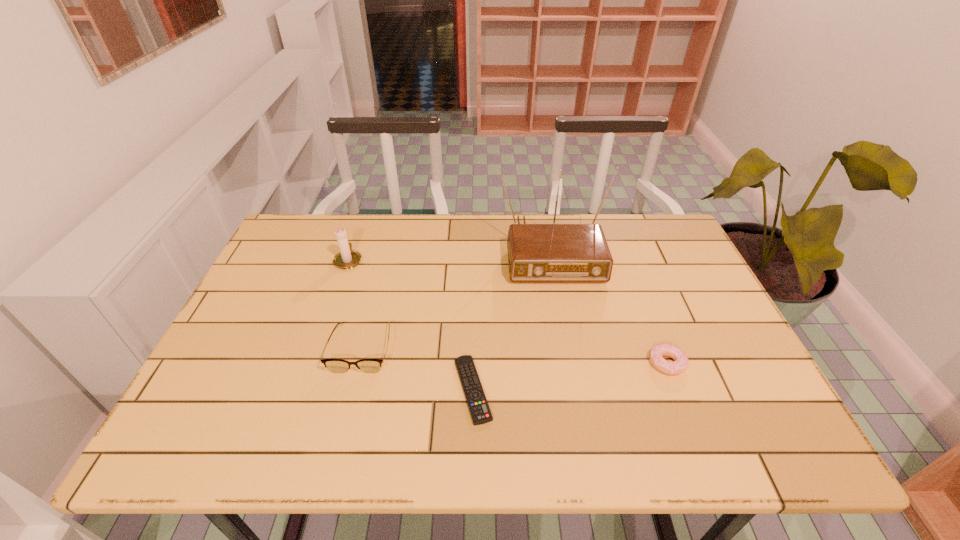
Identify the location of blank space located on the handle side of the second tallest object. tap(361, 223).

In order to click on vacant area situated on the handle side of the second tallest object in this screenshot , I will do `click(359, 230)`.

Identify the location of vacant point located 0.160m on the face of the third shortest object. This screenshot has width=960, height=540. (339, 438).

Locate an element on the screen. The image size is (960, 540). free point located 0.120m on the front of the fourth tallest object is located at coordinates click(692, 427).

Find the location of a particular element. The height and width of the screenshot is (540, 960). vacant point located 0.060m on the front of the third object from right to left is located at coordinates (472, 454).

Identify the location of radio_receiver positioned at the far edge. (537, 253).

You are a GUI agent. You are given a task and a screenshot of the screen. Output one action in this format:
    pyautogui.click(x=<x>, y=<y>)
    Task: Click on the candle holder that is at the far edge
    The image size is (960, 540).
    Given the screenshot: What is the action you would take?
    pyautogui.click(x=347, y=258)

I want to click on object at the near edge, so click(x=477, y=403).

Find the location of a particular element. object situated at the right edge is located at coordinates (680, 363).

Locate an element on the screen. This screenshot has height=540, width=960. free region at the far edge of the desktop is located at coordinates (582, 221).